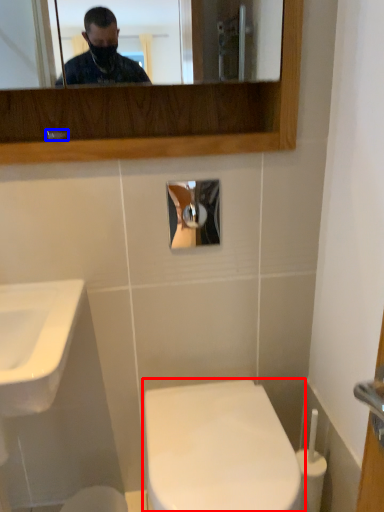
Question: Which point is closer to the camera, toilet (highlighted by a red box) or faucet (highlighted by a blue box)?

Choices:
 (A) toilet
 (B) faucet

Answer: (A)